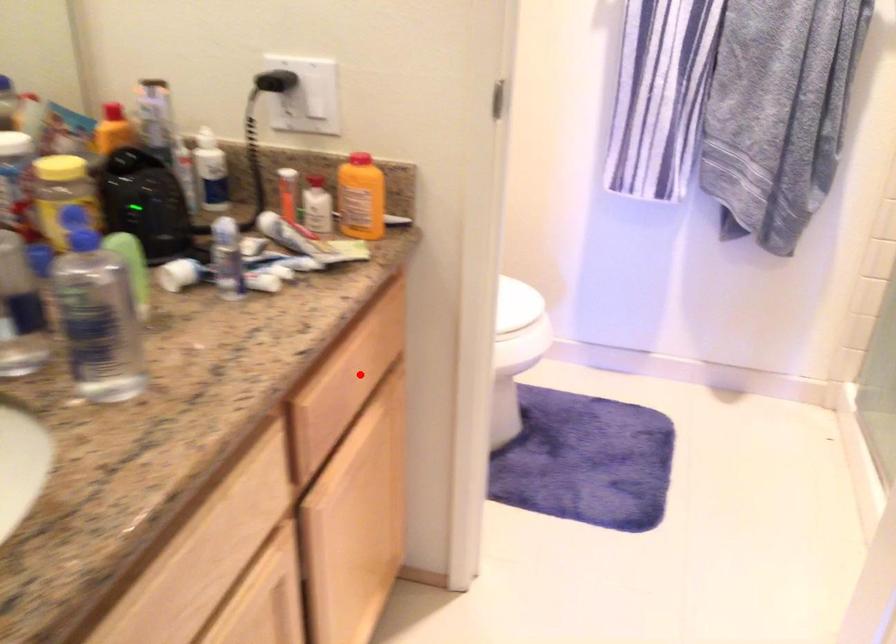
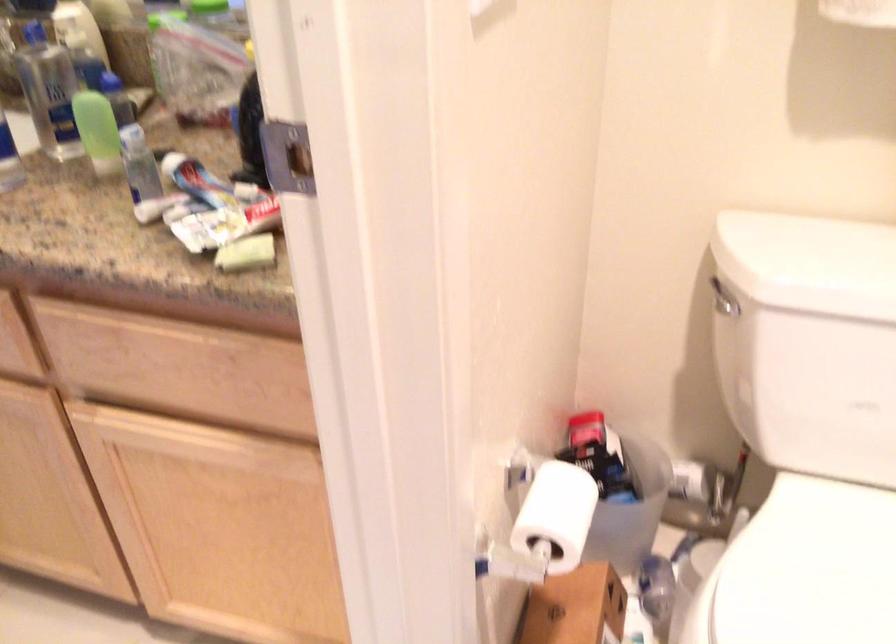
Question: I am providing you with two images of the same scene from different viewpoints. A red point is shown in image1. For the corresponding object point in image2, is it positioned nearer or farther from the camera?

Choices:
 (A) Nearer
 (B) Farther

Answer: (A)